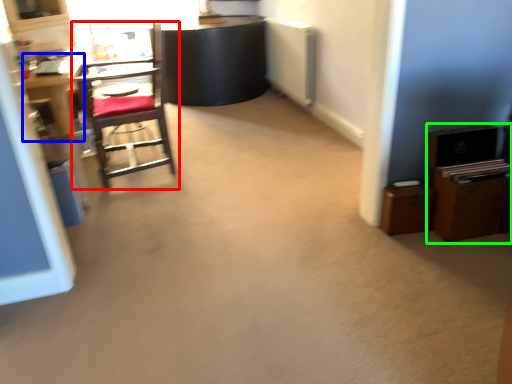
Question: Estimate the real-world distances between objects in this image. Which object is farther from chair (highlighted by a red box), desk (highlighted by a blue box) or dresser (highlighted by a green box)?

Choices:
 (A) desk
 (B) dresser

Answer: (B)